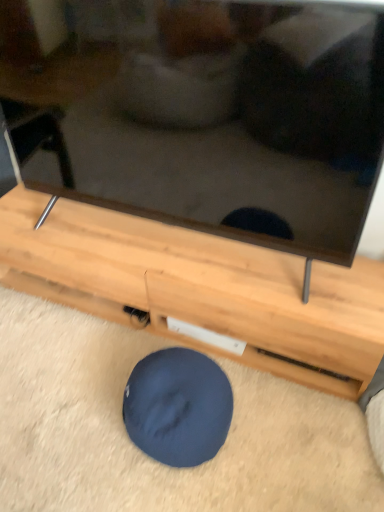
The image size is (384, 512). What are the coordinates of `dark blue fabric dog bed at lower center` in the screenshot? It's located at (178, 407).

This screenshot has height=512, width=384. What do you see at coordinates (178, 407) in the screenshot?
I see `dark blue fabric dog bed at lower center` at bounding box center [178, 407].

The image size is (384, 512). In order to click on wooden tv stand at center in this screenshot , I will do `click(200, 288)`.

What is the approximate height of wooden tv stand at center?

11.71 inches.

What do you see at coordinates (200, 288) in the screenshot?
I see `wooden tv stand at center` at bounding box center [200, 288].

Identify the location of dark blue fabric dog bed at lower center. (178, 407).

Is dark blue fabric dog bed at lower center to the left or to the right of wooden tv stand at center in the image?

In the image, dark blue fabric dog bed at lower center appears on the right side of wooden tv stand at center.

Which object is further away from the camera taking this photo, dark blue fabric dog bed at lower center or wooden tv stand at center?

wooden tv stand at center.

Is point (200, 417) closer to viewer compared to point (215, 255)?

That is True.

Looking at this image, from the image's perspective, is dark blue fabric dog bed at lower center below wooden tv stand at center?

Correct, dark blue fabric dog bed at lower center appears lower than wooden tv stand at center in the image.

In the scene shown: From a real-world perspective, is dark blue fabric dog bed at lower center physically above wooden tv stand at center?

Incorrect, from a real-world perspective, dark blue fabric dog bed at lower center is lower than wooden tv stand at center.

Is dark blue fabric dog bed at lower center wider or thinner than wooden tv stand at center?

Clearly, dark blue fabric dog bed at lower center has less width compared to wooden tv stand at center.

Is dark blue fabric dog bed at lower center taller than wooden tv stand at center?

No, dark blue fabric dog bed at lower center is not taller than wooden tv stand at center.

Who is bigger, dark blue fabric dog bed at lower center or wooden tv stand at center?

Bigger between the two is wooden tv stand at center.

Choose the correct answer: Is dark blue fabric dog bed at lower center inside wooden tv stand at center or outside it?

dark blue fabric dog bed at lower center is not enclosed by wooden tv stand at center.

Is dark blue fabric dog bed at lower center not close to wooden tv stand at center?

No.

Could you tell me if dark blue fabric dog bed at lower center is facing wooden tv stand at center?

No, dark blue fabric dog bed at lower center does not turn towards wooden tv stand at center.

How different are the orientations of dark blue fabric dog bed at lower center and wooden tv stand at center in degrees?

The angular difference between dark blue fabric dog bed at lower center and wooden tv stand at center is 2.66 degrees.

Find the location of a particular element. dog bed that is on the right side of wooden tv stand at center is located at coordinates pos(178,407).

Is wooden tv stand at center to the left of dark blue fabric dog bed at lower center from the viewer's perspective?

Indeed, wooden tv stand at center is positioned on the left side of dark blue fabric dog bed at lower center.

Which object is further away from the camera, wooden tv stand at center or dark blue fabric dog bed at lower center?

wooden tv stand at center is behind.

Is point (204, 348) positioned behind point (204, 437)?

Yes, it is behind point (204, 437).

From the image's perspective, relative to dark blue fabric dog bed at lower center, is wooden tv stand at center above or below?

Clearly, from the image's perspective, wooden tv stand at center is above dark blue fabric dog bed at lower center.

Looking at this image, from a real-world perspective, which is physically below, wooden tv stand at center or dark blue fabric dog bed at lower center?

In real-world perspective, dark blue fabric dog bed at lower center is lower.

Based on the photo, considering the relative sizes of wooden tv stand at center and dark blue fabric dog bed at lower center in the image provided, is wooden tv stand at center thinner than dark blue fabric dog bed at lower center?

Incorrect, the width of wooden tv stand at center is not less than that of dark blue fabric dog bed at lower center.

Is wooden tv stand at center shorter than dark blue fabric dog bed at lower center?

Incorrect, the height of wooden tv stand at center does not fall short of that of dark blue fabric dog bed at lower center.

Does wooden tv stand at center have a smaller size compared to dark blue fabric dog bed at lower center?

Incorrect, wooden tv stand at center is not smaller in size than dark blue fabric dog bed at lower center.

Is dark blue fabric dog bed at lower center completely or partially inside wooden tv stand at center?

No, dark blue fabric dog bed at lower center is not surrounded by wooden tv stand at center.

Would you consider wooden tv stand at center to be distant from dark blue fabric dog bed at lower center?

No, wooden tv stand at center is not far from dark blue fabric dog bed at lower center.

Is wooden tv stand at center facing towards dark blue fabric dog bed at lower center?

Yes, wooden tv stand at center is oriented towards dark blue fabric dog bed at lower center.

Where is `dog bed to the right of wooden tv stand at center`? The width and height of the screenshot is (384, 512). dog bed to the right of wooden tv stand at center is located at coordinates (178, 407).

Locate an element on the screen. furniture above the dark blue fabric dog bed at lower center (from a real-world perspective) is located at coordinates (200, 288).

Find the location of `dog bed lying in front of the wooden tv stand at center`. dog bed lying in front of the wooden tv stand at center is located at coordinates (178, 407).